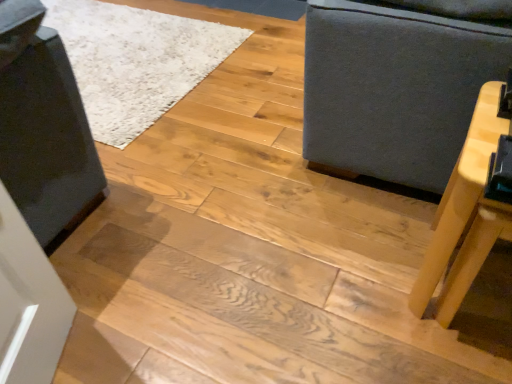
Where is `light wood table at right`? Image resolution: width=512 pixels, height=384 pixels. light wood table at right is located at coordinates (466, 214).

This screenshot has height=384, width=512. Describe the element at coordinates (466, 214) in the screenshot. I see `light wood table at right` at that location.

What do you see at coordinates (398, 83) in the screenshot? This screenshot has height=384, width=512. I see `gray fabric sofa at right` at bounding box center [398, 83].

Locate an element on the screen. Image resolution: width=512 pixels, height=384 pixels. gray fabric sofa at right is located at coordinates (398, 83).

Locate an element on the screen. This screenshot has width=512, height=384. light wood table at right is located at coordinates coord(466,214).

Which object is positioned more to the right, gray fabric sofa at right or light wood table at right?

Positioned to the right is gray fabric sofa at right.

Which is in front, gray fabric sofa at right or light wood table at right?

light wood table at right is in front.

Is point (327, 113) positioned after point (454, 266)?

That is True.

From the image's perspective, is gray fabric sofa at right on top of light wood table at right?

Indeed, from the image's perspective, gray fabric sofa at right is shown above light wood table at right.

From a real-world perspective, is gray fabric sofa at right positioned above or below light wood table at right?

→ gray fabric sofa at right is above light wood table at right.

Which of these two, gray fabric sofa at right or light wood table at right, is thinner?

light wood table at right is thinner.

In terms of height, does gray fabric sofa at right look taller or shorter compared to light wood table at right?

Considering their sizes, gray fabric sofa at right has more height than light wood table at right.

Looking at this image, between gray fabric sofa at right and light wood table at right, which one has larger size?

With larger size is gray fabric sofa at right.

Choose the correct answer: Is gray fabric sofa at right inside light wood table at right or outside it?

gray fabric sofa at right is outside light wood table at right.

Are gray fabric sofa at right and light wood table at right beside each other?

No.

Is gray fabric sofa at right looking in the opposite direction of light wood table at right?

No, gray fabric sofa at right is not facing away from light wood table at right.

How different are the orientations of gray fabric sofa at right and light wood table at right in degrees?

The facing directions of gray fabric sofa at right and light wood table at right are 3.25 degrees apart.

How far apart are gray fabric sofa at right and light wood table at right?

gray fabric sofa at right and light wood table at right are 13.28 inches apart from each other.

Where is `furniture to the right of light wood table at right`? furniture to the right of light wood table at right is located at coordinates (398, 83).

Is light wood table at right at the right side of gray fabric sofa at right?

In fact, light wood table at right is to the left of gray fabric sofa at right.

Which object is further away from the camera taking this photo, light wood table at right or gray fabric sofa at right?

gray fabric sofa at right is more distant.

Which is less distant, (479,192) or (508,23)?

Point (479,192) is closer to the camera than point (508,23).

From the image's perspective, who appears lower, light wood table at right or gray fabric sofa at right?

light wood table at right appears lower in the image.

From a real-world perspective, is light wood table at right positioned under gray fabric sofa at right based on gravity?

Yes, from a real-world perspective, light wood table at right is under gray fabric sofa at right.

Is light wood table at right wider or thinner than gray fabric sofa at right?

In the image, light wood table at right appears to be more narrow than gray fabric sofa at right.

Considering the relative sizes of light wood table at right and gray fabric sofa at right in the image provided, is light wood table at right taller than gray fabric sofa at right?

No.

Can you confirm if light wood table at right is bigger than gray fabric sofa at right?

Incorrect, light wood table at right is not larger than gray fabric sofa at right.

Is gray fabric sofa at right located within light wood table at right?

No.

Are light wood table at right and gray fabric sofa at right making contact?

light wood table at right and gray fabric sofa at right are clearly separated.

Is light wood table at right facing away from gray fabric sofa at right?

No, gray fabric sofa at right is not at the back of light wood table at right.

How different are the orientations of light wood table at right and gray fabric sofa at right in degrees?

The facing directions of light wood table at right and gray fabric sofa at right are 3.25 degrees apart.

Where is `furniture behind the light wood table at right`? This screenshot has height=384, width=512. furniture behind the light wood table at right is located at coordinates (398, 83).

I want to click on table located underneath the gray fabric sofa at right (from a real-world perspective), so click(466, 214).

What are the coordinates of `furniture on the right of light wood table at right` in the screenshot? It's located at (398, 83).